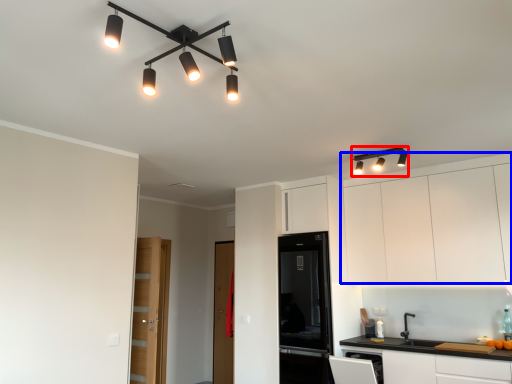
Question: Which point is closer to the camera, light fixture (highlighted by a red box) or cabinetry (highlighted by a blue box)?

Choices:
 (A) light fixture
 (B) cabinetry

Answer: (B)